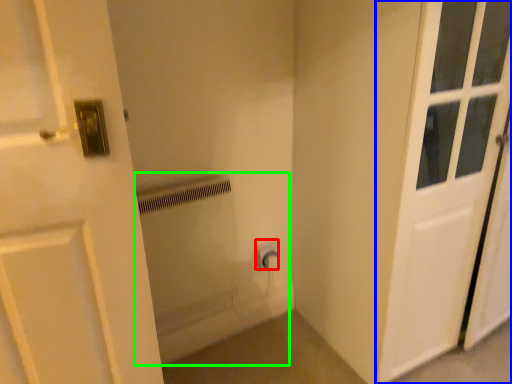
Question: Considering the real-world distances, which object is closest to electric outlet (highlighted by a red box)? door (highlighted by a blue box) or bath (highlighted by a green box).

Choices:
 (A) door
 (B) bath

Answer: (B)